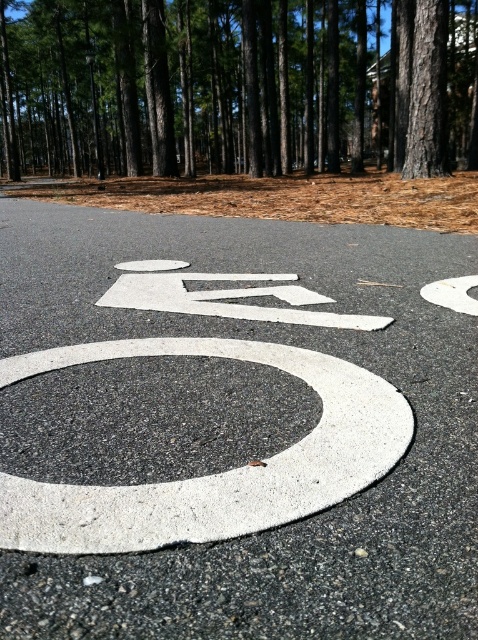
Does brown textured tree at center appear over white concrete circle at center?

Yes, brown textured tree at center is above white concrete circle at center.

Which is in front, point (14, 84) or point (264, 474)?

Point (264, 474)

Does point (270, 120) lie behind point (299, 448)?

That is True.

At what (x,y) coordinates should I click in order to perform the action: click on brown textured tree at center. Please return your answer as a coordinate pair (x, y). Looking at the image, I should click on (237, 86).

Can you confirm if brown textured tree at center is shorter than white painted number at center?

No.

Is brown textured tree at center above white painted number at center?

Indeed, brown textured tree at center is positioned over white painted number at center.

The height and width of the screenshot is (640, 478). What do you see at coordinates (237, 86) in the screenshot?
I see `brown textured tree at center` at bounding box center [237, 86].

Where is `brown textured tree at center`? This screenshot has width=478, height=640. brown textured tree at center is located at coordinates (237, 86).

Between white concrete circle at center and white painted number at center, which one has more height?

white painted number at center is taller.

From the picture: Is white concrete circle at center closer to camera compared to white painted number at center?

That is True.

Describe the element at coordinates (215, 474) in the screenshot. I see `white concrete circle at center` at that location.

Where is `white concrete circle at center`? This screenshot has width=478, height=640. white concrete circle at center is located at coordinates (215, 474).